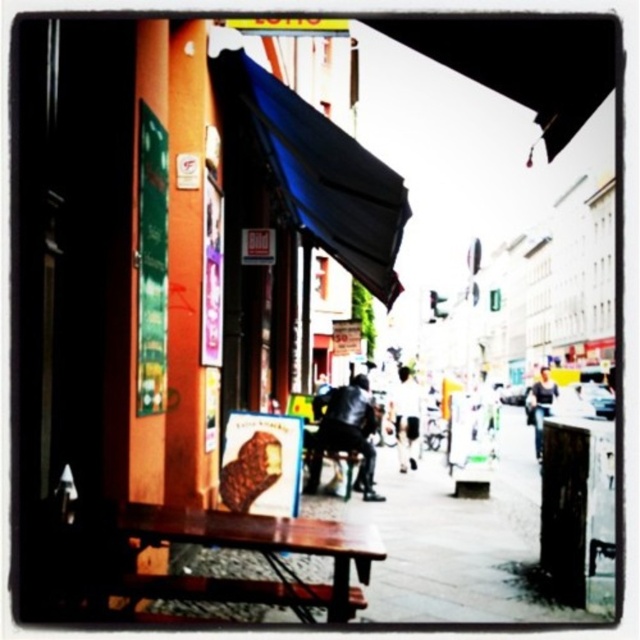
Question: Among these objects, which one is nearest to the camera?

Choices:
 (A) leather jacket at center
 (B) white fabric bag at center
 (C) wooden bench at center

Answer: (C)

Question: Does blue fabric umbrella at upper center have a greater width compared to leather jacket at center?

Choices:
 (A) no
 (B) yes

Answer: (B)

Question: Which of the following is the farthest from the observer?

Choices:
 (A) wooden bench at center
 (B) light blue denim jacket at center

Answer: (B)

Question: Does leather jacket at center have a larger size compared to light blue denim jacket at center?

Choices:
 (A) yes
 (B) no

Answer: (B)

Question: Which point is farther from the camera taking this photo?

Choices:
 (A) (364, 456)
 (B) (392, 264)
 (C) (362, 545)

Answer: (A)

Question: Where is wooden bench at lower center located in relation to white fabric bag at center in the image?

Choices:
 (A) below
 (B) above

Answer: (B)